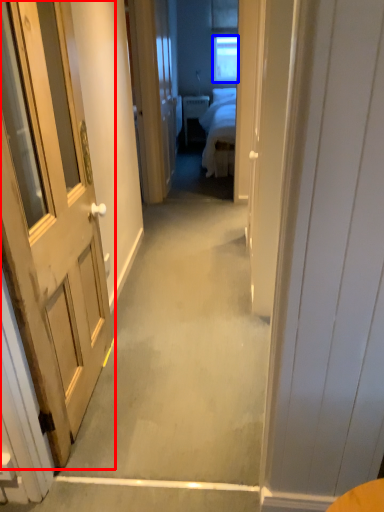
Question: Which object is closer to the camera taking this photo, door (highlighted by a red box) or window (highlighted by a blue box)?

Choices:
 (A) door
 (B) window

Answer: (A)